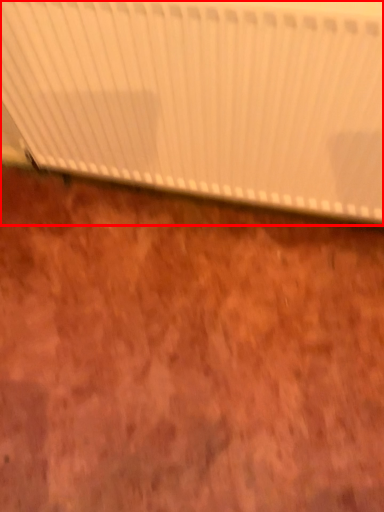
Question: From the image's perspective, where is curtain (annotated by the red box) located relative to plywood?

Choices:
 (A) below
 (B) above

Answer: (B)